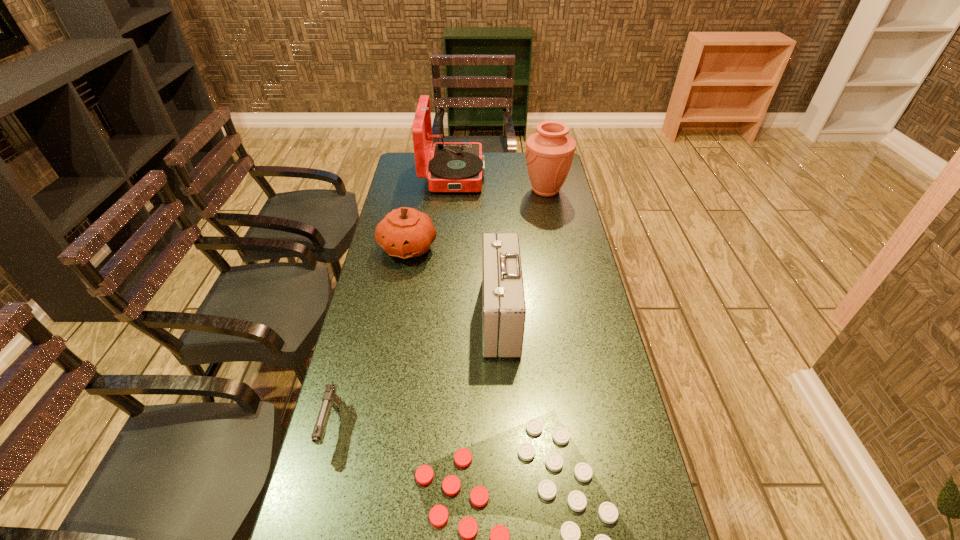
The image size is (960, 540). What are the coordinates of `free space that satisfies the following two spatial constraints: 1. on the front-facing side of the first-aid kit; 2. in the direction the second shortest object is aimed` in the screenshot? It's located at (505, 427).

This screenshot has width=960, height=540. I want to click on free location that satisfies the following two spatial constraints: 1. on the front-facing side of the third tallest object; 2. in the direction the fifth tallest object is aimed, so click(x=505, y=427).

Identify the location of free space that satisfies the following two spatial constraints: 1. on the front-facing side of the phonograph_record; 2. in the direction the second shortest object is aimed. The width and height of the screenshot is (960, 540). click(432, 427).

Where is `vacant area in the image that satisfies the following two spatial constraints: 1. on the front-facing side of the first-aid kit; 2. in the direction the fifth tallest object is aimed`? vacant area in the image that satisfies the following two spatial constraints: 1. on the front-facing side of the first-aid kit; 2. in the direction the fifth tallest object is aimed is located at coordinates (505, 427).